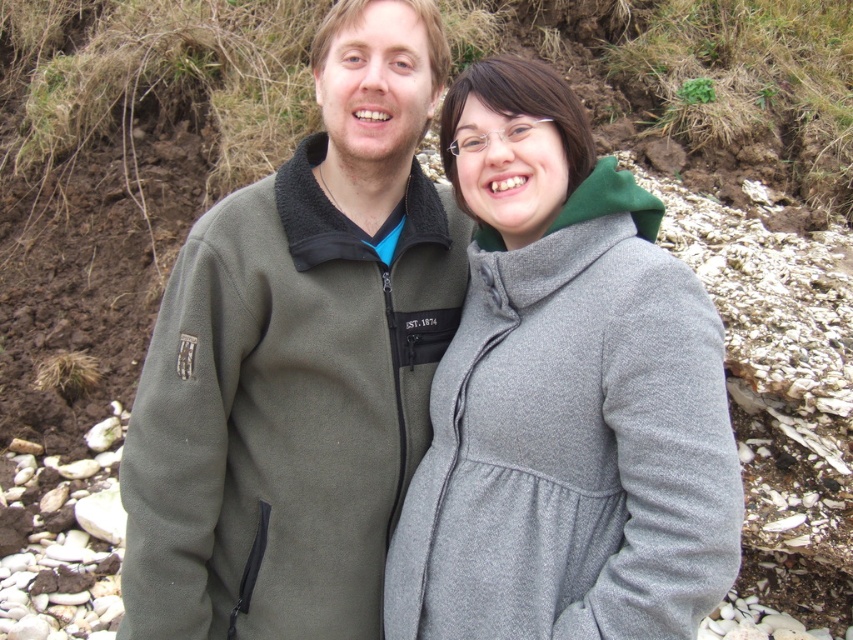
Based on the photo, between green fleece jacket at center and gray woolen coat at center, which one has less height?

With less height is gray woolen coat at center.

Is green fleece jacket at center further to the viewer compared to gray woolen coat at center?

Yes, it is behind gray woolen coat at center.

Is point (172, 500) positioned before point (540, 532)?

No, (172, 500) is behind (540, 532).

Locate an element on the screen. The height and width of the screenshot is (640, 853). green fleece jacket at center is located at coordinates (299, 362).